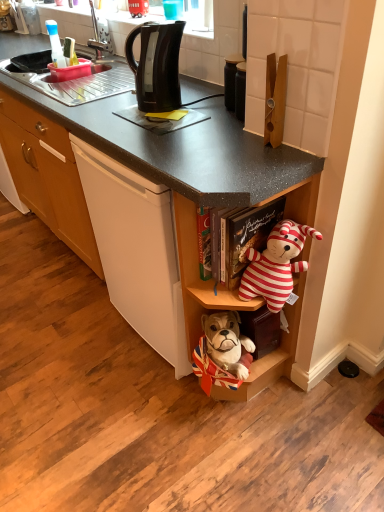
Identify the location of empty space that is to the right of black plastic kettle at upper center. (208, 103).